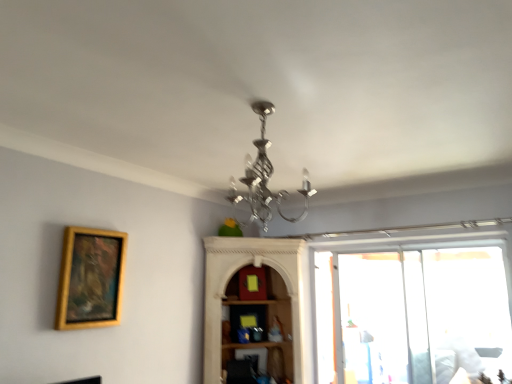
Question: Is silver metallic chandelier at center in front of or behind gold wooden picture frame at left in the image?

Choices:
 (A) front
 (B) behind

Answer: (A)

Question: Is silver metallic chandelier at center spatially inside gold wooden picture frame at left, or outside of it?

Choices:
 (A) inside
 (B) outside

Answer: (B)

Question: Based on their relative distances, which object is nearer to the gold wooden picture frame at left?

Choices:
 (A) silver metallic chandelier at center
 (B) transparent plastic screen door at right

Answer: (A)

Question: Estimate the real-world distances between objects in this image. Which object is closer to the silver metallic chandelier at center?

Choices:
 (A) transparent plastic screen door at right
 (B) gold wooden picture frame at left

Answer: (B)